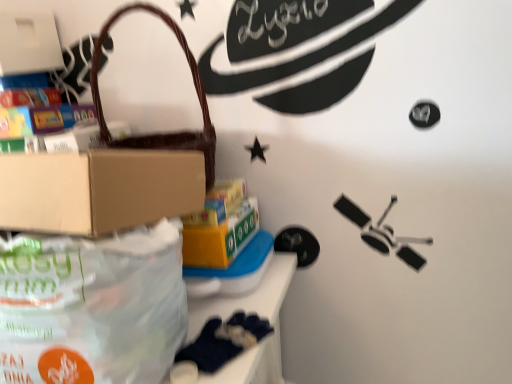
In order to click on brown woven handbag at upper left in this screenshot , I will do `click(164, 133)`.

Find the location of a particular element. white matte box at upper left, the 1th box from the left is located at coordinates (29, 43).

Locate an element on the screen. This screenshot has height=384, width=512. yellow cardboard box at center, the first box ordered from the bottom is located at coordinates (221, 238).

What do you see at coordinates (92, 307) in the screenshot?
I see `translucent plastic bag at lower left` at bounding box center [92, 307].

Where is `translucent plastic bag at lower left`? The image size is (512, 384). translucent plastic bag at lower left is located at coordinates (92, 307).

Identify the location of brown woven handbag at upper left. (164, 133).

Locate an element on the screen. This screenshot has height=384, width=512. diaper bag that is on the left side of yellow cardboard box at center, placed as the 2th box when sorted from left to right is located at coordinates (92, 307).

Is yellow cardboard box at center, placed as the 2th box when sorted from left to right, completely or partially inside translucent plastic bag at lower left?

Definitely not — yellow cardboard box at center, placed as the 2th box when sorted from left to right, is not inside translucent plastic bag at lower left.

From the picture: Considering the relative positions of translucent plastic bag at lower left and yellow cardboard box at center, the first box ordered from the bottom, in the image provided, is translucent plastic bag at lower left to the right of yellow cardboard box at center, the first box ordered from the bottom, from the viewer's perspective?

No, translucent plastic bag at lower left is not to the right of yellow cardboard box at center, the first box ordered from the bottom.

How far apart are white matte box at upper left, which is counted as the second box, starting from the right, and brown woven handbag at upper left?

white matte box at upper left, which is counted as the second box, starting from the right, and brown woven handbag at upper left are 9.72 inches apart from each other.

Is white matte box at upper left, the 2th box from the bottom, turned away from brown woven handbag at upper left?

white matte box at upper left, the 2th box from the bottom, does not have its back to brown woven handbag at upper left.

Can you confirm if white matte box at upper left, the 1th box from the left, is positioned to the left of brown woven handbag at upper left?

Correct, you'll find white matte box at upper left, the 1th box from the left, to the left of brown woven handbag at upper left.

You are a GUI agent. You are given a task and a screenshot of the screen. Output one action in this format:
    pyautogui.click(x=<x>, y=<y>)
    Task: Click on the 2nd box behind the brown woven handbag at upper left
    Image resolution: width=512 pixels, height=384 pixels.
    Given the screenshot: What is the action you would take?
    pyautogui.click(x=29, y=43)

Is white matte box at upper left, which is counted as the second box, starting from the right, inside yellow cardboard box at center, placed as the 2th box when sorted from left to right?

That's incorrect, white matte box at upper left, which is counted as the second box, starting from the right, is not inside yellow cardboard box at center, placed as the 2th box when sorted from left to right.

Does yellow cardboard box at center, which is counted as the 1th box, starting from the right, have a greater height compared to white matte box at upper left, the 2th box from the bottom?

Incorrect, the height of yellow cardboard box at center, which is counted as the 1th box, starting from the right, is not larger of that of white matte box at upper left, the 2th box from the bottom.

Considering the sizes of objects yellow cardboard box at center, which appears as the second box when viewed from the top, and white matte box at upper left, the 2th box from the bottom, in the image provided, who is wider, yellow cardboard box at center, which appears as the second box when viewed from the top, or white matte box at upper left, the 2th box from the bottom,?

Wider between the two is yellow cardboard box at center, which appears as the second box when viewed from the top.

In the scene shown: From the image's perspective, is translucent plastic bag at lower left under dark blue fabric at lower left?

No.

How far apart are translucent plastic bag at lower left and dark blue fabric at lower left?

translucent plastic bag at lower left is 5.56 inches away from dark blue fabric at lower left.

Does translucent plastic bag at lower left have a lesser width compared to dark blue fabric at lower left?

No.

Which is more distant, (105, 287) or (187, 359)?

Point (187, 359)

Considering the points (202, 366) and (228, 225), which point is behind, point (202, 366) or point (228, 225)?

The point (228, 225) is farther from the camera.

Considering their positions, is dark blue fabric at lower left located in front of or behind yellow cardboard box at center, which appears as the second box when viewed from the top?

Visually, dark blue fabric at lower left is located in front of yellow cardboard box at center, which appears as the second box when viewed from the top.

Would you say dark blue fabric at lower left is to the left or to the right of yellow cardboard box at center, the first box ordered from the bottom, in the picture?

From the image, it's evident that dark blue fabric at lower left is to the right of yellow cardboard box at center, the first box ordered from the bottom.

Is brown woven handbag at upper left looking in the opposite direction of dark blue fabric at lower left?

No.

In the scene shown: Can you confirm if brown woven handbag at upper left is wider than dark blue fabric at lower left?

Incorrect, the width of brown woven handbag at upper left does not surpass that of dark blue fabric at lower left.

From a real-world perspective, does brown woven handbag at upper left sit lower than dark blue fabric at lower left?

Actually, brown woven handbag at upper left is physically above dark blue fabric at lower left in the real world.

Identify the location of toy located underneath the brown woven handbag at upper left (from a real-world perspective). (224, 341).

Considering the sizes of objects translucent plastic bag at lower left and brown woven handbag at upper left in the image provided, who is taller, translucent plastic bag at lower left or brown woven handbag at upper left?

With more height is brown woven handbag at upper left.

From a real-world perspective, who is located lower, translucent plastic bag at lower left or brown woven handbag at upper left?

translucent plastic bag at lower left.

Does translucent plastic bag at lower left contain brown woven handbag at upper left?

No.

Who is more distant, translucent plastic bag at lower left or brown woven handbag at upper left?

brown woven handbag at upper left.

Identify the location of box lying on the right of translucent plastic bag at lower left. (221, 238).

You are a GUI agent. You are given a task and a screenshot of the screen. Output one action in this format:
    pyautogui.click(x=<x>, y=<y>)
    Task: Click on the handbag lying in front of the white matte box at upper left, which is counted as the second box, starting from the right
    The image size is (512, 384).
    Given the screenshot: What is the action you would take?
    pyautogui.click(x=164, y=133)

Estimate the real-world distances between objects in this image. Which object is closer to yellow cardboard box at center, which is counted as the 1th box, starting from the right, brown woven handbag at upper left or translucent plastic bag at lower left?

brown woven handbag at upper left lies closer to yellow cardboard box at center, which is counted as the 1th box, starting from the right, than the other object.

Looking at the image, which one is located closer to translucent plastic bag at lower left, yellow cardboard box at center, which appears as the second box when viewed from the top, or white matte box at upper left, which is counted as the second box, starting from the right?

Based on the image, yellow cardboard box at center, which appears as the second box when viewed from the top, appears to be nearer to translucent plastic bag at lower left.

From the image, which object appears to be nearer to yellow cardboard box at center, which appears as the second box when viewed from the top, translucent plastic bag at lower left or dark blue fabric at lower left?

The object closer to yellow cardboard box at center, which appears as the second box when viewed from the top, is dark blue fabric at lower left.

Which object lies nearer to the anchor point brown woven handbag at upper left, translucent plastic bag at lower left or white matte box at upper left, the 1th box from the left?

white matte box at upper left, the 1th box from the left, lies closer to brown woven handbag at upper left than the other object.

Estimate the real-world distances between objects in this image. Which object is closer to yellow cardboard box at center, which appears as the second box when viewed from the top, translucent plastic bag at lower left or brown woven handbag at upper left?

The object closer to yellow cardboard box at center, which appears as the second box when viewed from the top, is brown woven handbag at upper left.

From the image, which object appears to be farther from translucent plastic bag at lower left, brown woven handbag at upper left or yellow cardboard box at center, which is counted as the 1th box, starting from the right?

brown woven handbag at upper left lies further to translucent plastic bag at lower left than the other object.

From the image, which object appears to be nearer to white matte box at upper left, which is counted as the second box, starting from the right, yellow cardboard box at center, placed as the 2th box when sorted from left to right, or dark blue fabric at lower left?

yellow cardboard box at center, placed as the 2th box when sorted from left to right, is positioned closer to the anchor white matte box at upper left, which is counted as the second box, starting from the right.

Considering their positions, is white matte box at upper left, the 2th box from the bottom, positioned closer to translucent plastic bag at lower left than dark blue fabric at lower left?

dark blue fabric at lower left lies closer to translucent plastic bag at lower left than the other object.

This screenshot has width=512, height=384. I want to click on handbag located between white matte box at upper left, the 2th box from the bottom, and yellow cardboard box at center, placed as the 2th box when sorted from left to right, in the left-right direction, so [164, 133].

Find the location of a particular element. This screenshot has height=384, width=512. box that lies between brown woven handbag at upper left and dark blue fabric at lower left from top to bottom is located at coordinates (221, 238).

Image resolution: width=512 pixels, height=384 pixels. I want to click on diaper bag between white matte box at upper left, the 2th box from the bottom, and yellow cardboard box at center, placed as the 2th box when sorted from left to right, so click(92, 307).

The width and height of the screenshot is (512, 384). Find the location of `diaper bag between brown woven handbag at upper left and dark blue fabric at lower left vertically`. diaper bag between brown woven handbag at upper left and dark blue fabric at lower left vertically is located at coordinates (92, 307).